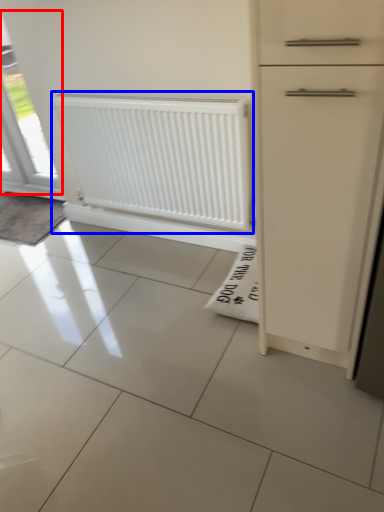
Question: Which of the following is the closest to the observer, window (highlighted by a red box) or radiator (highlighted by a blue box)?

Choices:
 (A) window
 (B) radiator

Answer: (B)